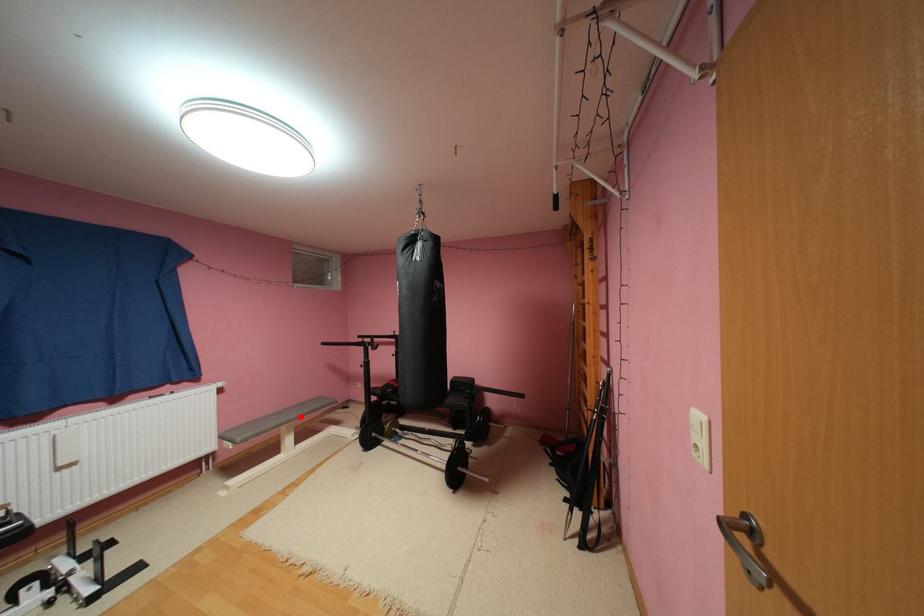
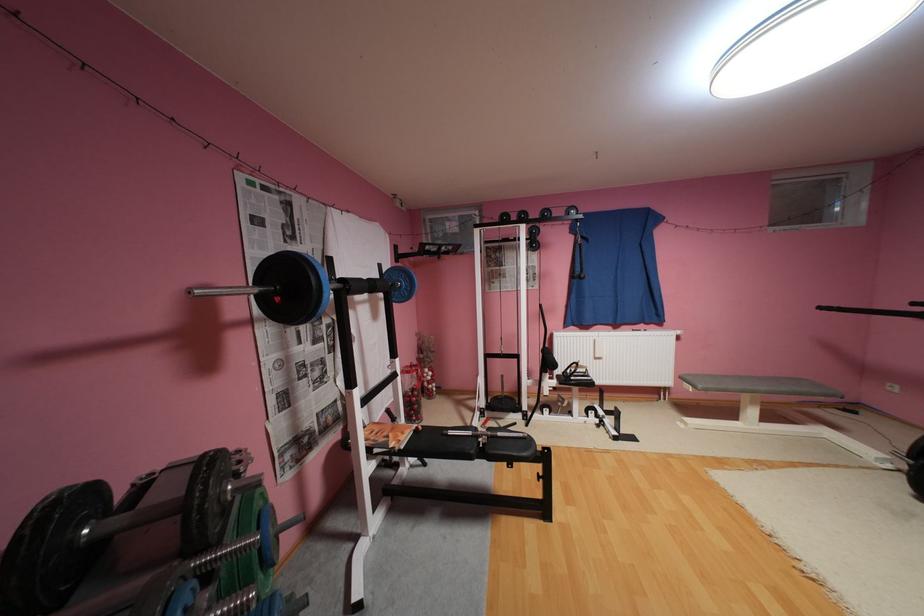
Where in the second image is the point corresponding to the highlighted location from the first image?

(771, 387)